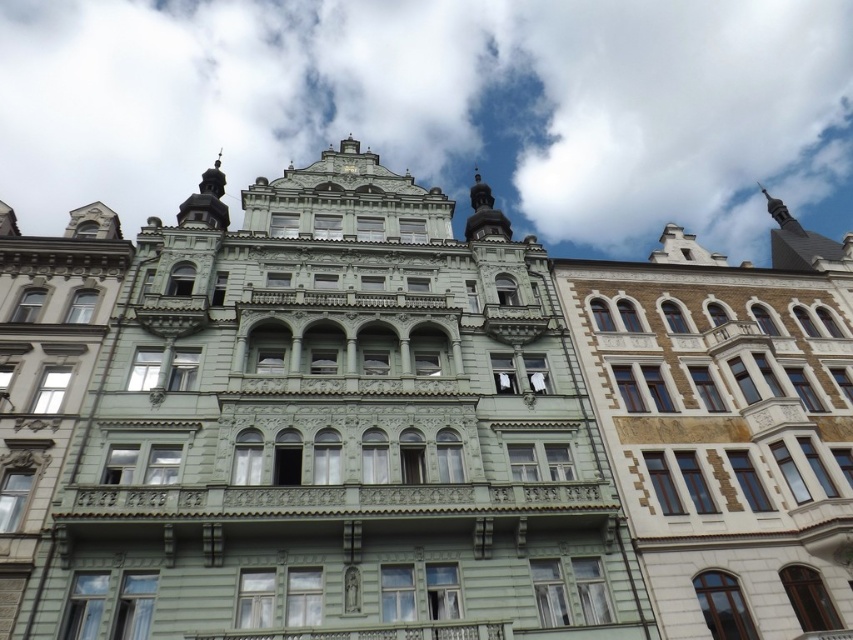
You are an architect examining the building and notice the white fluffy cloud at upper center and the gold textured clock at upper center. Which object appears closer to you in the image?

The white fluffy cloud at upper center appears closer to you because it is further to the viewer than the gold textured clock at upper center.

You are standing in front of the grand building and notice a point marked at coordinates (444, 108). What object is located at that specific coordinate?

The point at (444, 108) indicates a white fluffy cloud at upper center.